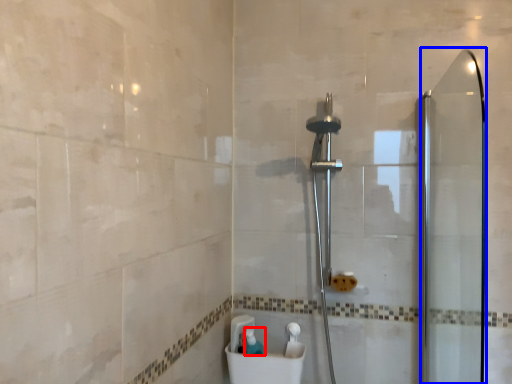
Question: Which point is closer to the camera, toiletry (highlighted by a red box) or screen door (highlighted by a blue box)?

Choices:
 (A) toiletry
 (B) screen door

Answer: (B)